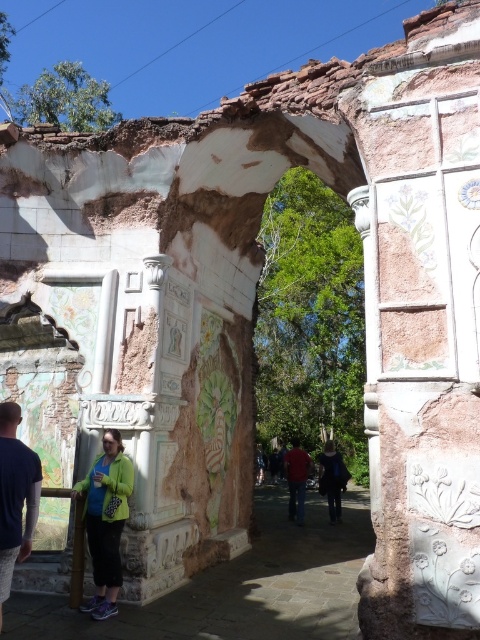
Question: Can you confirm if green matte jacket at center is positioned to the right of dark blue textured shirt at center?

Choices:
 (A) yes
 (B) no

Answer: (A)

Question: Is green matte jacket at center to the left of dark blue textured shirt at center from the viewer's perspective?

Choices:
 (A) yes
 (B) no

Answer: (B)

Question: Which of the following is the closest to the observer?

Choices:
 (A) (336, 502)
 (B) (96, 536)
 (C) (289, 476)
 (D) (0, 550)

Answer: (D)

Question: Which object is farther from the camera taking this photo?

Choices:
 (A) red matte shirt at center
 (B) dark blue textured shirt at center

Answer: (A)

Question: Is dark blue jeans at center further to camera compared to red matte shirt at center?

Choices:
 (A) no
 (B) yes

Answer: (B)

Question: Which of the following is the farthest from the observer?

Choices:
 (A) (340, 513)
 (B) (4, 481)

Answer: (A)